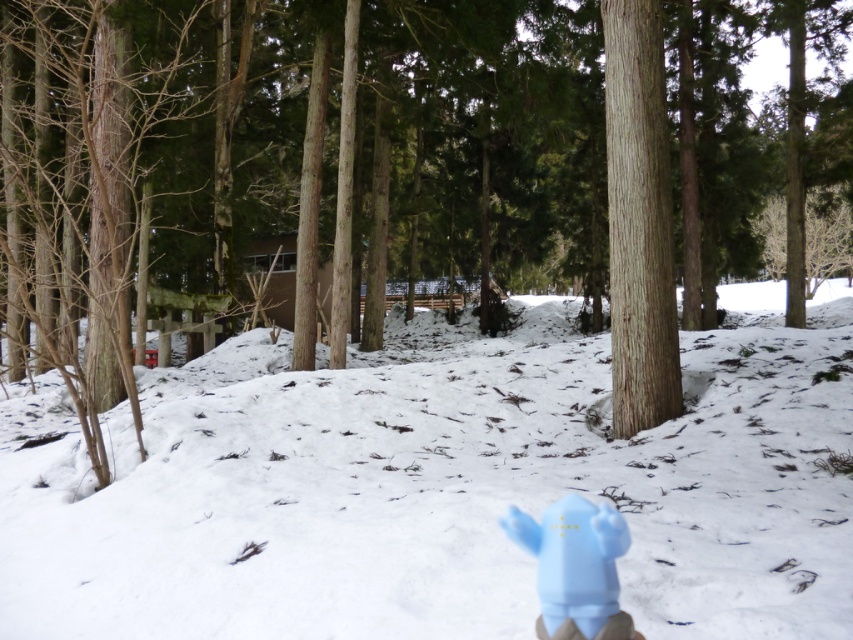
Does point (393, 602) come in front of point (604, 17)?

Yes, it is.

Is white fluffy snow at center closer to camera compared to smooth brown tree trunk at center-right?

Yes, it is in front of smooth brown tree trunk at center-right.

Based on the photo, who is more distant from viewer, [802,544] or [619,12]?

Point [619,12]

Where is `white fluffy snow at center`? This screenshot has width=853, height=640. white fluffy snow at center is located at coordinates (437, 488).

Who is more distant from viewer, (637, 224) or (564, 536)?

Point (637, 224)

In the scene shown: Can you confirm if smooth brown tree trunk at center-right is taller than light blue plastic toy at lower right?

Correct, smooth brown tree trunk at center-right is much taller as light blue plastic toy at lower right.

Is point (654, 376) less distant than point (520, 520)?

No, it is not.

I want to click on smooth brown tree trunk at center-right, so click(637, 220).

Is point (218, 531) farther from camera compared to point (573, 609)?

Yes, point (218, 531) is farther from viewer.

Between point (399, 576) and point (622, 612), which one is positioned in front?

Point (622, 612) is more forward.

Identify the location of white fluffy snow at center. (437, 488).